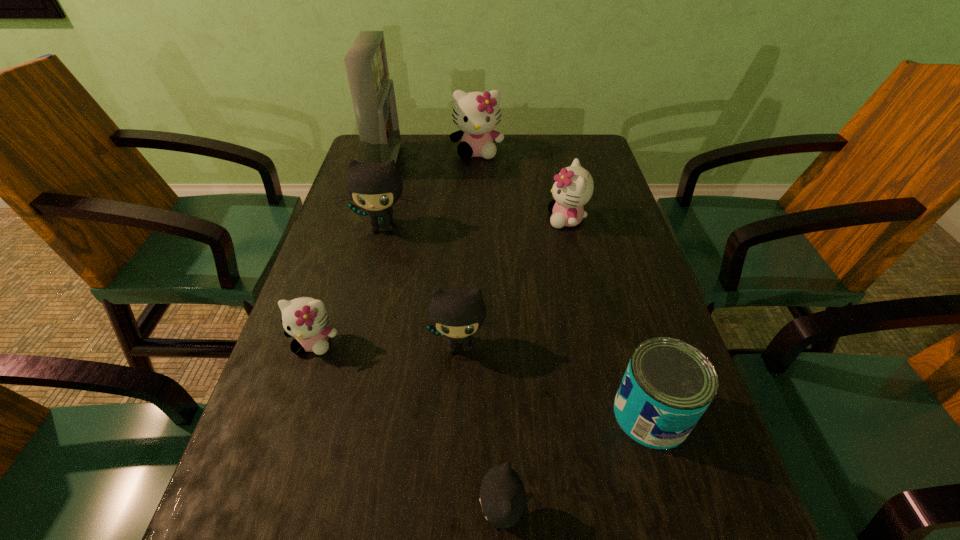
Where is `free space located 0.140m on the back of the can`? The width and height of the screenshot is (960, 540). free space located 0.140m on the back of the can is located at coordinates (624, 322).

The height and width of the screenshot is (540, 960). What are the coordinates of `free space located 0.280m on the front-facing side of the leftmost white kitten` in the screenshot? It's located at (256, 521).

In order to click on the first-aid kit situated at the far edge in this screenshot , I will do `click(372, 92)`.

I want to click on kitten present at the far edge, so click(x=476, y=114).

Locate an element on the screen. This screenshot has width=960, height=540. the first-aid kit at the left edge is located at coordinates (372, 92).

Find the location of a particular element. The image size is (960, 540). kitten located at the right edge is located at coordinates (573, 188).

Locate an element on the screen. The image size is (960, 540). can that is at the right edge is located at coordinates point(668,384).

This screenshot has height=540, width=960. What are the coordinates of `object present at the far left corner` in the screenshot? It's located at (372, 92).

In order to click on free region at the far edge of the desktop in this screenshot , I will do `click(512, 146)`.

The height and width of the screenshot is (540, 960). In the image, there is a desktop. In order to click on free space at the left edge in this screenshot , I will do tap(342, 194).